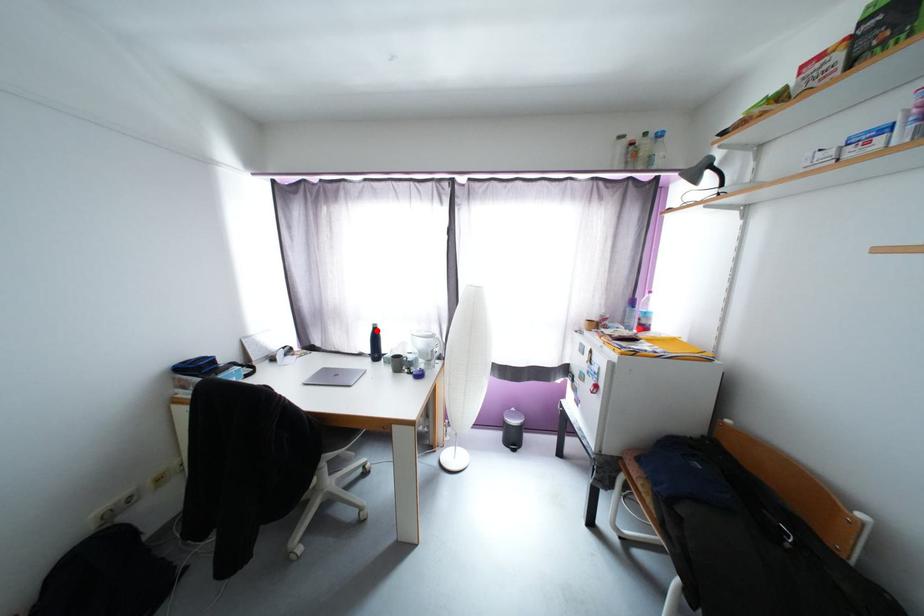
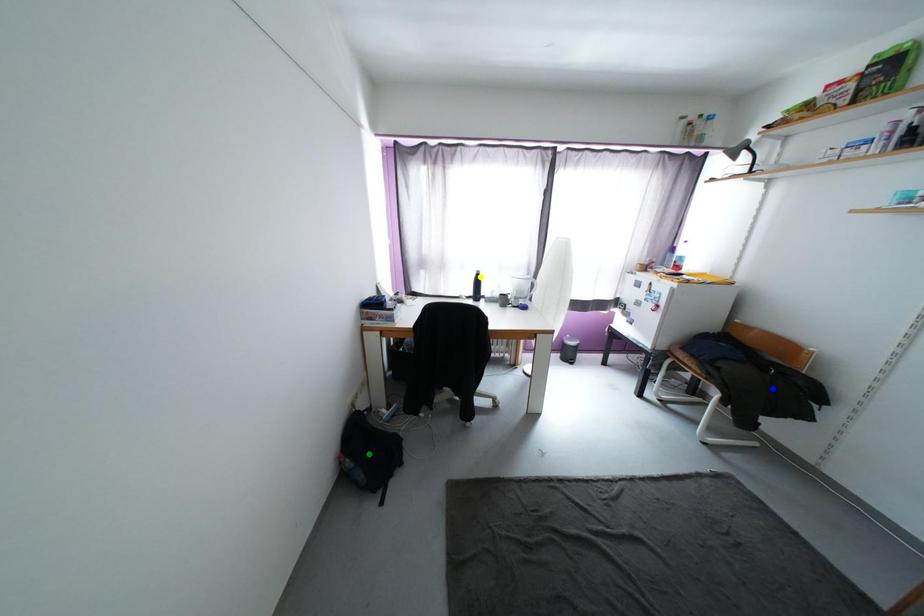
Question: I am providing you with two images of the same scene from different viewpoints. A red point is marked on the first image. You are given multiple points on the second image. Which point in image 2 is actually the same real-world point as the red point in image 1?

Choices:
 (A) yellow point
 (B) green point
 (C) blue point

Answer: (A)